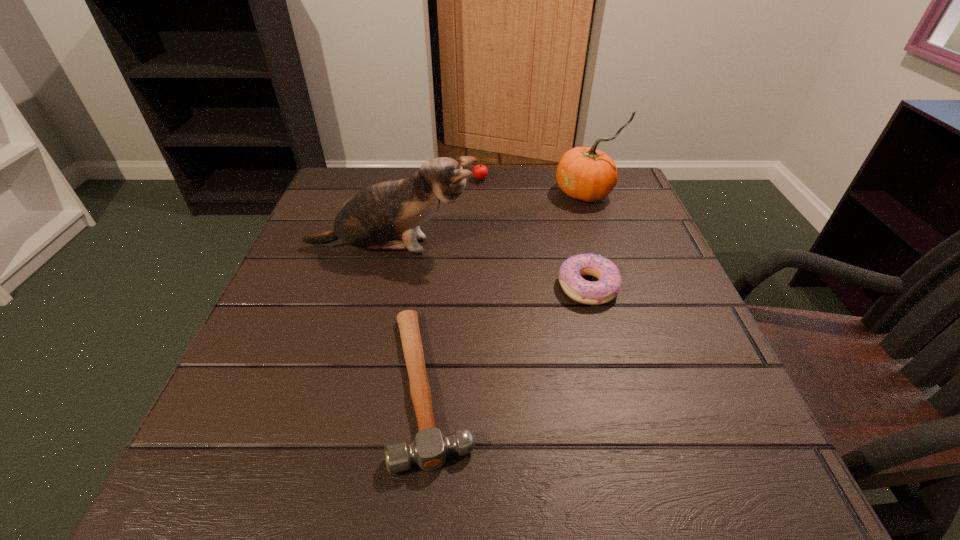
What are the coordinates of `pumpkin` in the screenshot? It's located at pyautogui.click(x=584, y=173).

The height and width of the screenshot is (540, 960). I want to click on cat, so click(x=387, y=215).

Locate an element on the screen. cherry is located at coordinates (480, 171).

Locate an element on the screen. the fourth tallest object is located at coordinates (602, 291).

Where is `doughnut`? The height and width of the screenshot is (540, 960). doughnut is located at coordinates (602, 291).

This screenshot has width=960, height=540. Identify the location of hammer. [x=429, y=450].

You are a GUI agent. You are given a task and a screenshot of the screen. Output one action in this format:
    pyautogui.click(x=<x>, y=<y>)
    Task: Click on the shortest object
    The width and height of the screenshot is (960, 540).
    Given the screenshot: What is the action you would take?
    pyautogui.click(x=429, y=450)

You are a GUI agent. You are given a task and a screenshot of the screen. Output one action in this format:
    pyautogui.click(x=<x>, y=<y>)
    Task: Click on the vacant space located on the front of the pumpkin
    
    Given the screenshot: What is the action you would take?
    pyautogui.click(x=602, y=240)

Locate an element on the screen. free location located 0.150m at the face of the cat is located at coordinates (548, 247).

You are a GUI agent. You are given a task and a screenshot of the screen. Output one action in this format:
    pyautogui.click(x=<x>, y=<y>)
    Task: Click on the blank space located on the front of the cherry
    
    Given the screenshot: What is the action you would take?
    pyautogui.click(x=482, y=241)